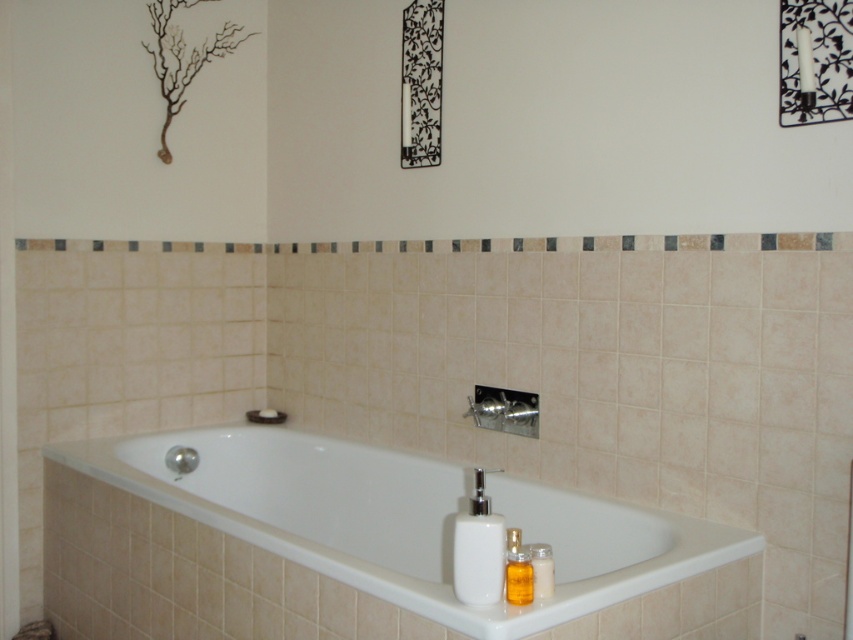
You are a guest in this bathroom and want to use the shower. You see the brushed metal shower at lower center and the white matte soap at upper left. Which object is located above the other?

The brushed metal shower at lower center is positioned over the white matte soap at upper left.

You are a home inspector assessing the bathroom layout. You need to determine if the translucent plastic bottle at lower right can be placed under the brushed metal shower at lower center without blocking the shower. Based on their sizes, what do you conclude?

The brushed metal shower at lower center is taller than the translucent plastic bottle at lower right. Since the shower is taller, placing the bottle underneath would not block it, so it is possible to place the translucent plastic bottle at lower right under the brushed metal shower at lower center without blocking the shower.

You are a guest in this bathroom and need to reach both the translucent plastic bottle at lower right and the white matte soap at upper left. Which item is easier to grab without moving your position?

The translucent plastic bottle at lower right is easier to grab because it is positioned below the white matte soap at upper left, making it closer to your hand level.